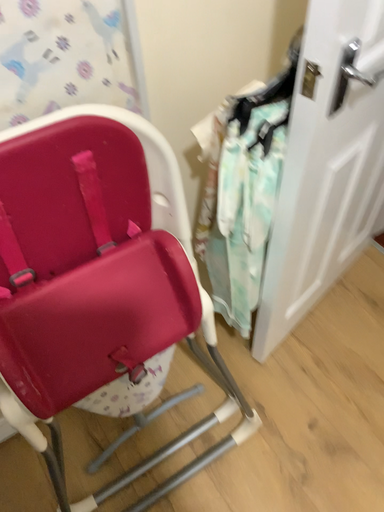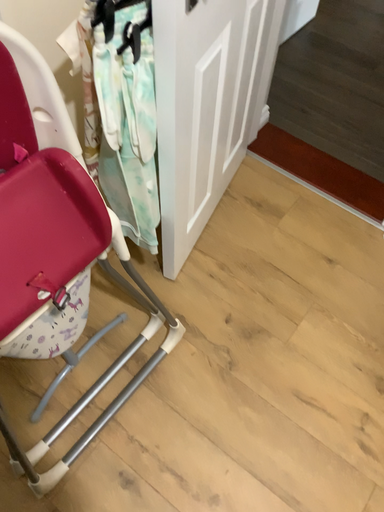
Question: Which way did the camera rotate in the video?

Choices:
 (A) rotated right
 (B) rotated left

Answer: (A)